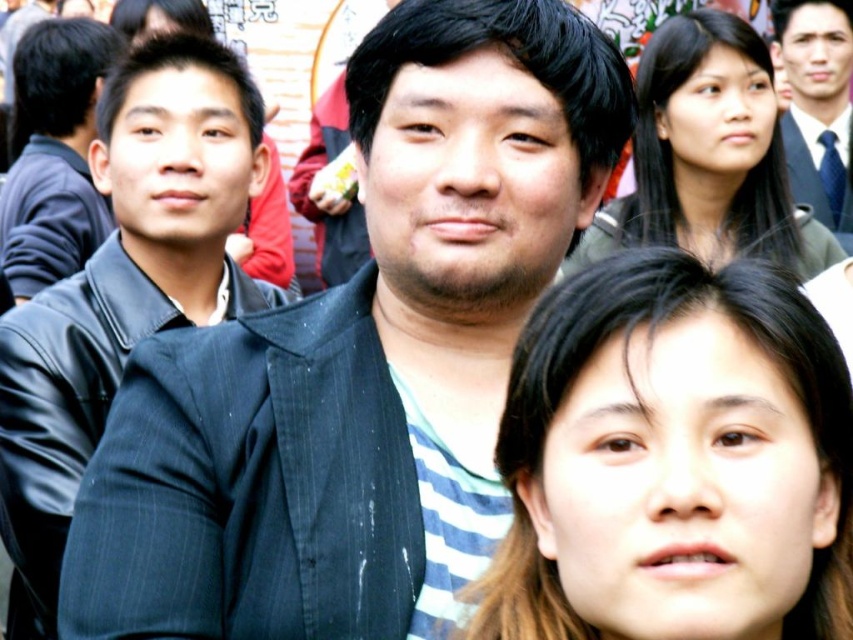
Question: Which point is closer to the camera?

Choices:
 (A) smooth black suit at upper right
 (B) brown hair at lower center
 (C) matte black jacket at left

Answer: (B)

Question: In this image, where is matte black jacket at left located relative to smooth black suit at upper right?

Choices:
 (A) right
 (B) left

Answer: (B)

Question: Does matte black jacket at left appear under smooth black suit at upper right?

Choices:
 (A) yes
 (B) no

Answer: (A)

Question: Which object is farther from the camera taking this photo?

Choices:
 (A) brown hair at lower center
 (B) black leather jacket at left

Answer: (B)

Question: Does brown hair at lower center appear under matte black jacket at left?

Choices:
 (A) yes
 (B) no

Answer: (A)

Question: Which point is closer to the camera taking this photo?

Choices:
 (A) (90, 88)
 (B) (473, 493)

Answer: (B)